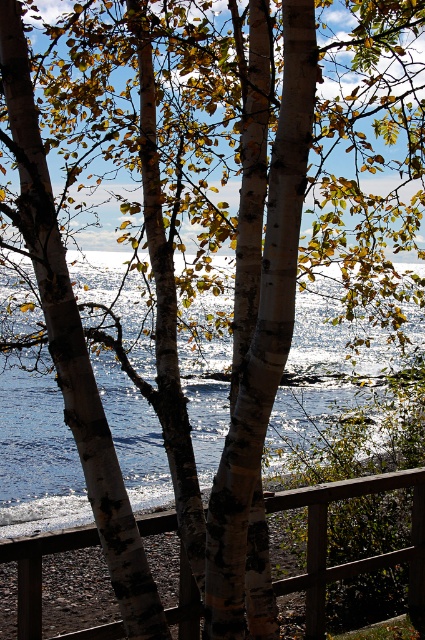
You are standing in a coastal area with birch trees around you. You see glistening water at center and wooden at center. Which one is higher up in the scene?

The glistening water at center is above wooden at center, so the glistening water at center is higher up in the scene.

You are standing at the edge of a coastal area and want to take a photo of the glistening water at center. If your camera has a maximum focus range of 8 meters, will you need to adjust your position to capture the water clearly?

The glistening water at center is 8.35 meters away from the camera. Since the maximum focus range is 8 meters, you need to move closer to ensure the glistening water at center is within the camera range.